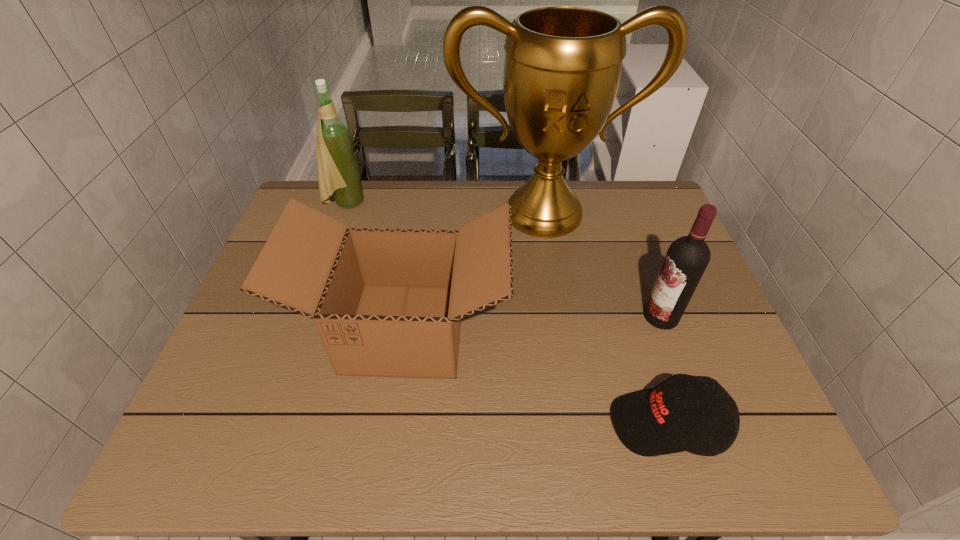
Find the location of a particular element. The image size is (960, 540). vacant space located 0.080m on the label of the nearer wine bottle is located at coordinates (612, 316).

This screenshot has height=540, width=960. I want to click on vacant region located on the label of the nearer wine bottle, so click(x=539, y=316).

Where is `vacant space located 0.140m on the left of the box`? The width and height of the screenshot is (960, 540). vacant space located 0.140m on the left of the box is located at coordinates (244, 329).

Locate an element on the screen. The height and width of the screenshot is (540, 960). vacant space located on the front-facing side of the baseball cap is located at coordinates (483, 424).

At what (x,y) coordinates should I click in order to perform the action: click on free space located 0.160m on the front-facing side of the baseball cap. Please return your answer as a coordinate pair (x, y). This screenshot has height=540, width=960. Looking at the image, I should click on (532, 424).

The width and height of the screenshot is (960, 540). Identify the location of vacant space positioned on the front-facing side of the baseball cap. (552, 424).

The width and height of the screenshot is (960, 540). I want to click on trophy cup that is at the far edge, so click(x=562, y=69).

Find the location of a particular element. This screenshot has width=960, height=540. wine bottle located at the far edge is located at coordinates (338, 175).

Where is `object present at the near edge`? object present at the near edge is located at coordinates (651, 422).

At what (x,y) coordinates should I click in order to perform the action: click on wine bottle located at the left edge. Please return your answer as a coordinate pair (x, y). Looking at the image, I should click on (338, 175).